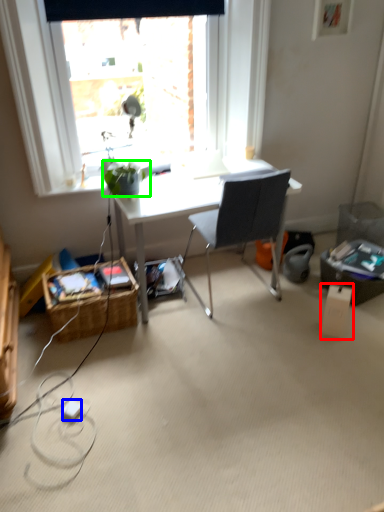
Question: Estimate the real-world distances between objects in this image. Which object is closer to box (highlighted by a red box), power outlet (highlighted by a blue box) or houseplant (highlighted by a green box)?

Choices:
 (A) power outlet
 (B) houseplant

Answer: (B)